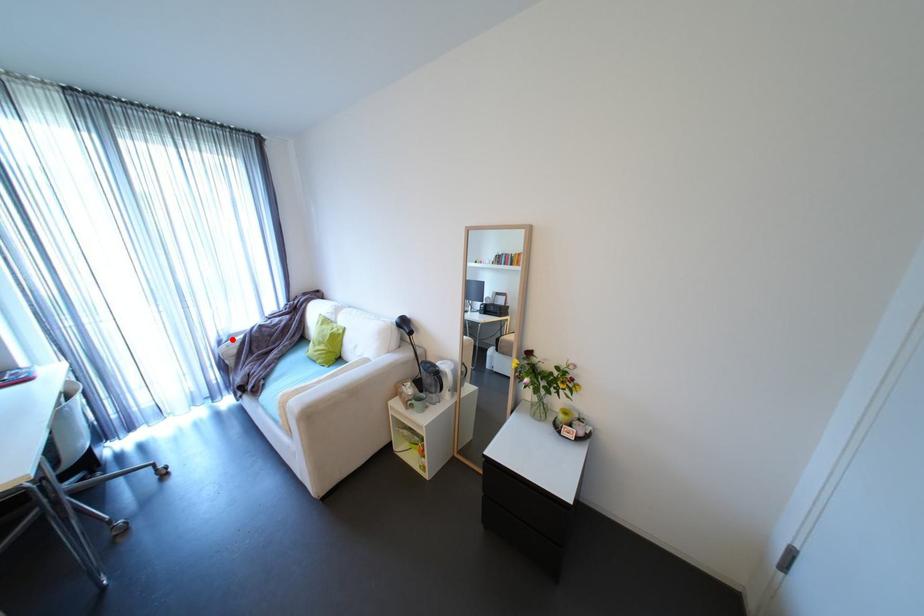
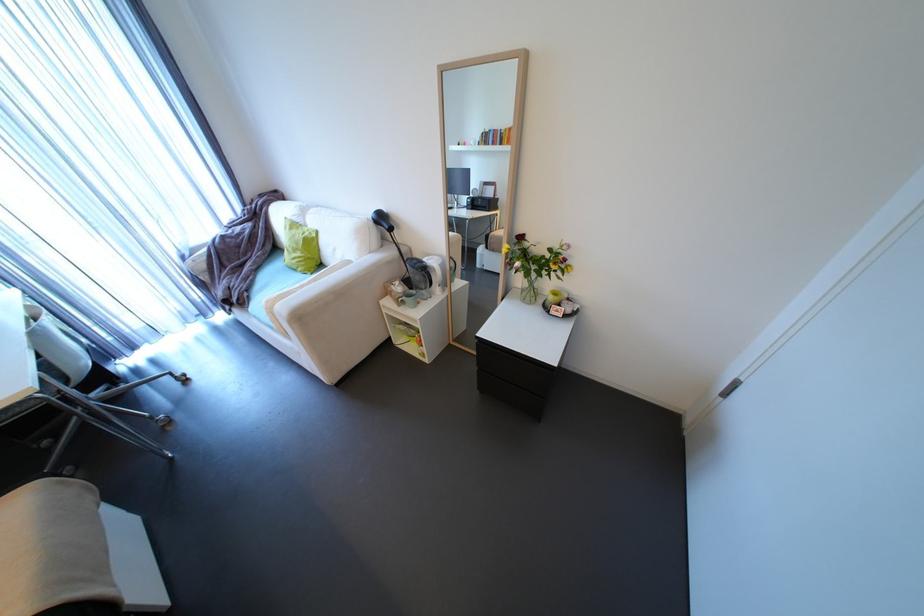
Where in the second image is the point corresponding to the highlighted location from the first image?

(195, 254)